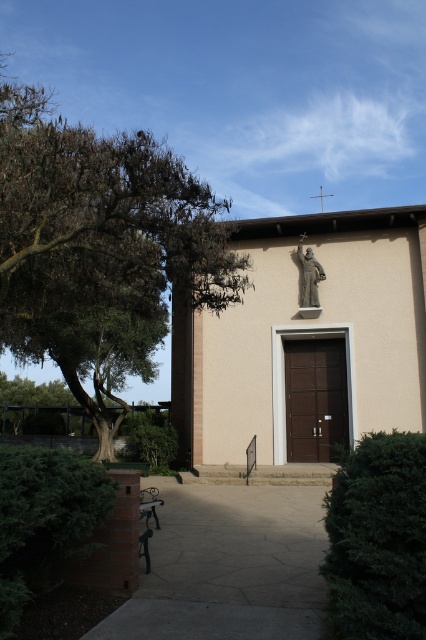
Is green leafy tree at left closer to the viewer compared to gray stone statue at upper center?

Yes, green leafy tree at left is in front of gray stone statue at upper center.

Does point (135, 230) lie behind point (302, 252)?

No, it is not.

Is point (154, 288) closer to camera compared to point (307, 304)?

Yes, point (154, 288) is closer to viewer.

Find the location of a particular element. The width and height of the screenshot is (426, 640). green leafy tree at left is located at coordinates (100, 250).

Measure the distance between green leafy tree at left and camera.

green leafy tree at left and camera are 7.28 meters apart from each other.

Between green leafy tree at left and wooden park bench at center, which one has more height?

green leafy tree at left

Who is more forward, (69, 182) or (149, 513)?

Point (69, 182)

At what (x,y) coordinates should I click in order to perform the action: click on green leafy tree at left. Please return your answer as a coordinate pair (x, y). This screenshot has height=640, width=426. Looking at the image, I should click on (100, 250).

Does beige stucco church at center have a larger size compared to wooden park bench at center?

Correct, beige stucco church at center is larger in size than wooden park bench at center.

Is beige stucco church at center above wooden park bench at center?

Yes, beige stucco church at center is above wooden park bench at center.

Between point (230, 445) and point (140, 513), which one is positioned behind?

The point (230, 445) is behind.

Where is `beige stucco church at center`? This screenshot has width=426, height=640. beige stucco church at center is located at coordinates click(307, 340).